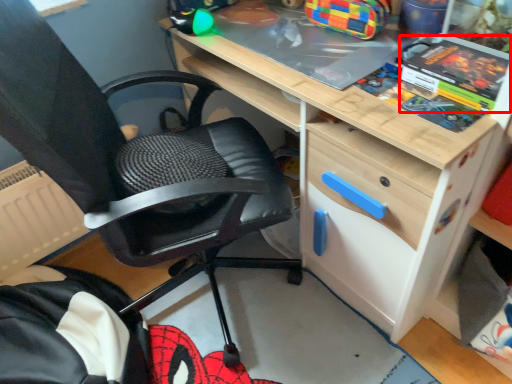
Question: From the image's perspective, where is comic book (annotated by the red box) located relative to chair?

Choices:
 (A) above
 (B) below

Answer: (A)